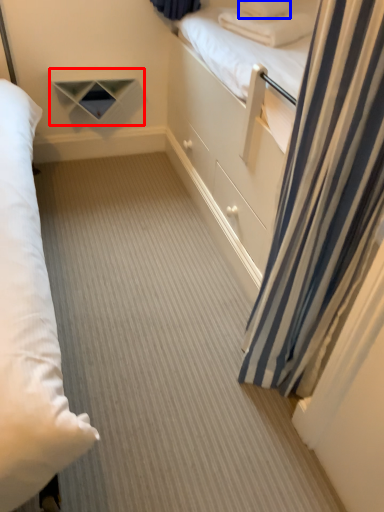
Question: Which point is closer to the camera, shelf (highlighted by a red box) or pillow (highlighted by a blue box)?

Choices:
 (A) shelf
 (B) pillow

Answer: (B)